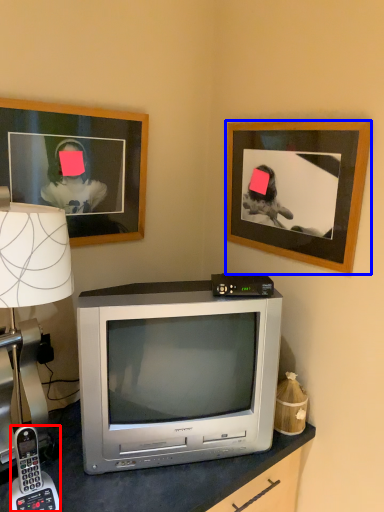
Question: Among these objects, which one is nearest to the camera, corded phone (highlighted by a red box) or picture frame (highlighted by a blue box)?

Choices:
 (A) corded phone
 (B) picture frame

Answer: (A)